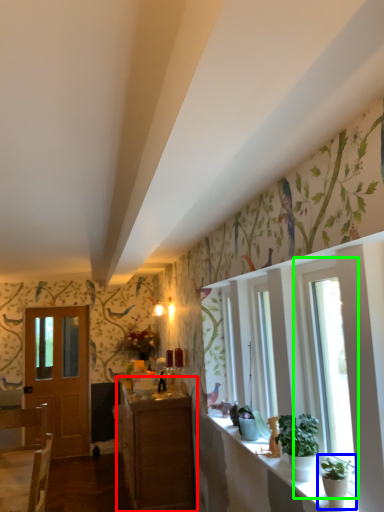
Question: Estimate the real-world distances between objects in this image. Which object is farther from cabinetry (highlighted by a red box), houseplant (highlighted by a blue box) or window (highlighted by a green box)?

Choices:
 (A) houseplant
 (B) window

Answer: (A)